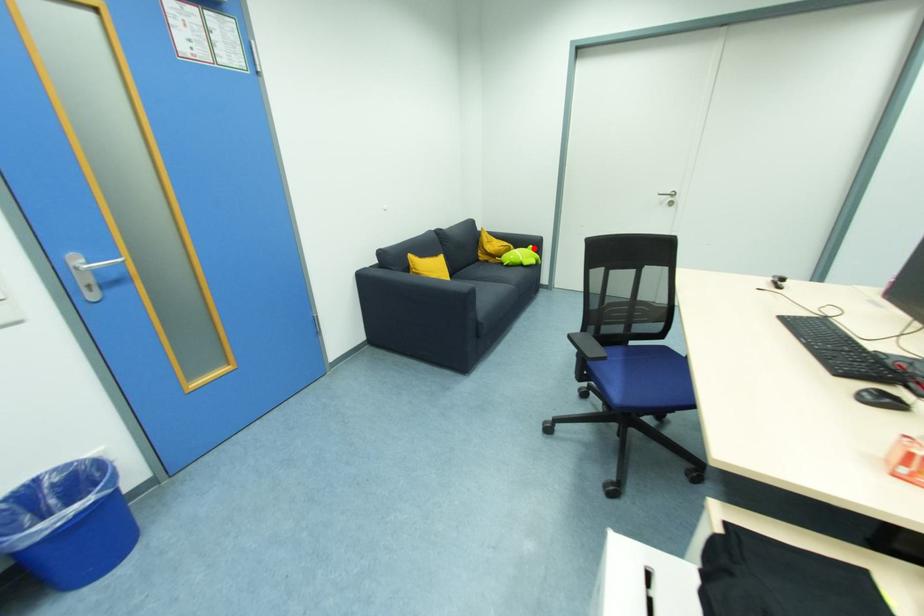
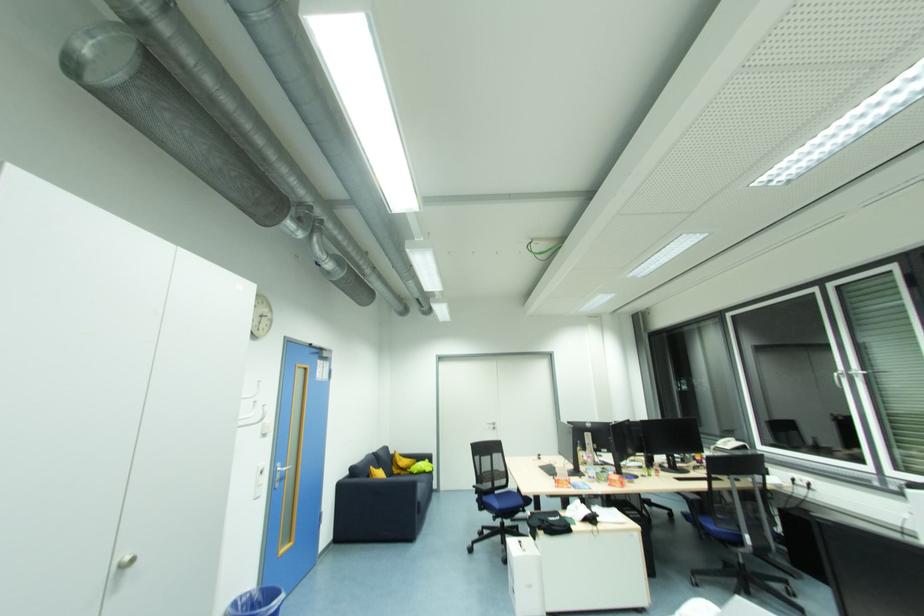
In the second image, find the point that corresponds to the highlighted location in the first image.

(430, 461)